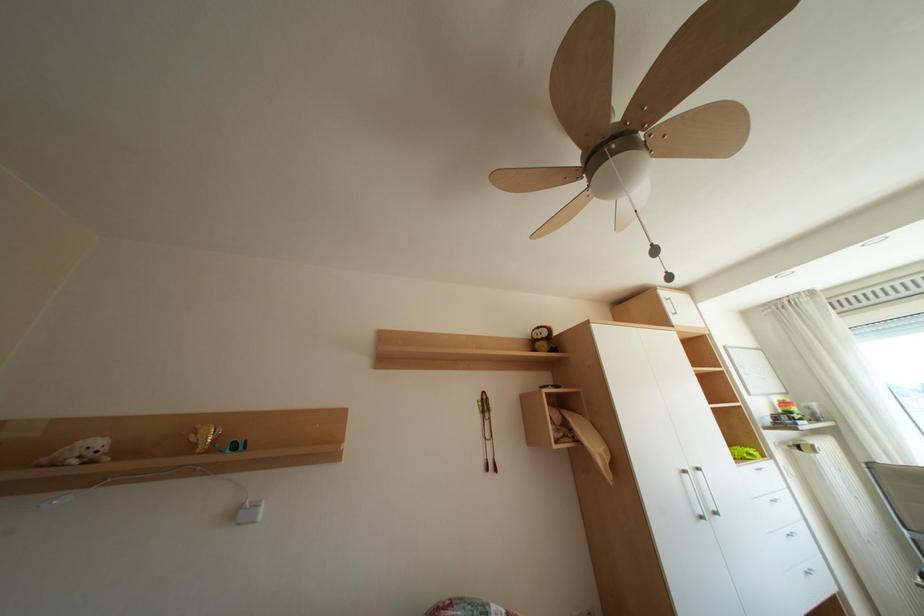
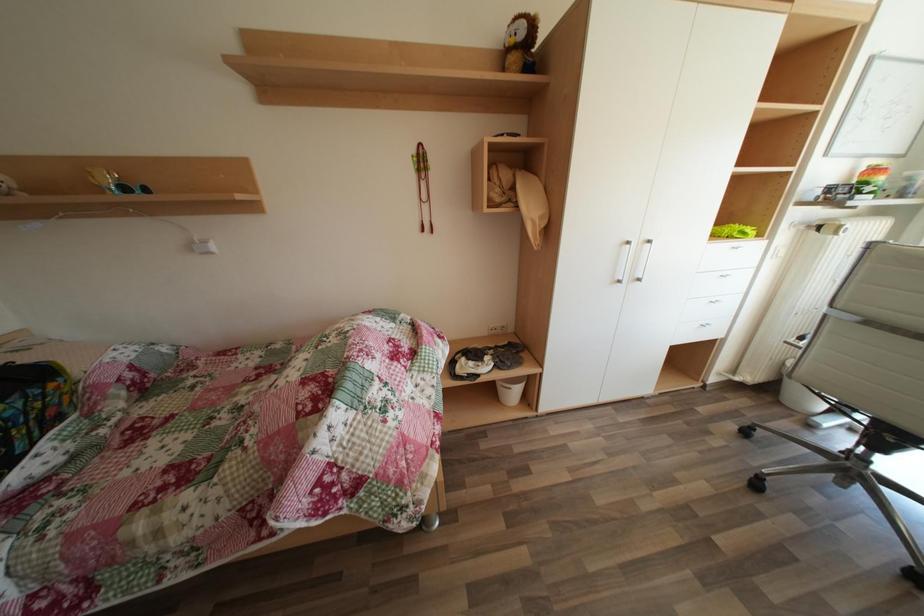
Question: How did the camera likely rotate?

Choices:
 (A) Left
 (B) Right
 (C) Up
 (D) Down

Answer: (D)